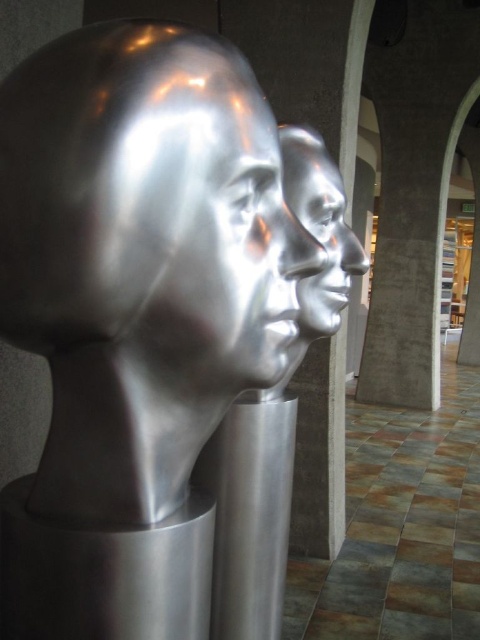
Question: Is shiny metallic head at center smaller than polished silver face at center?

Choices:
 (A) no
 (B) yes

Answer: (B)

Question: Does shiny metallic head at center appear over polished silver face at center?

Choices:
 (A) no
 (B) yes

Answer: (A)

Question: Is shiny metallic head at center closer to camera compared to polished silver face at center?

Choices:
 (A) yes
 (B) no

Answer: (A)

Question: Which of the following is the farthest from the observer?

Choices:
 (A) polished silver face at center
 (B) shiny metallic head at center

Answer: (A)